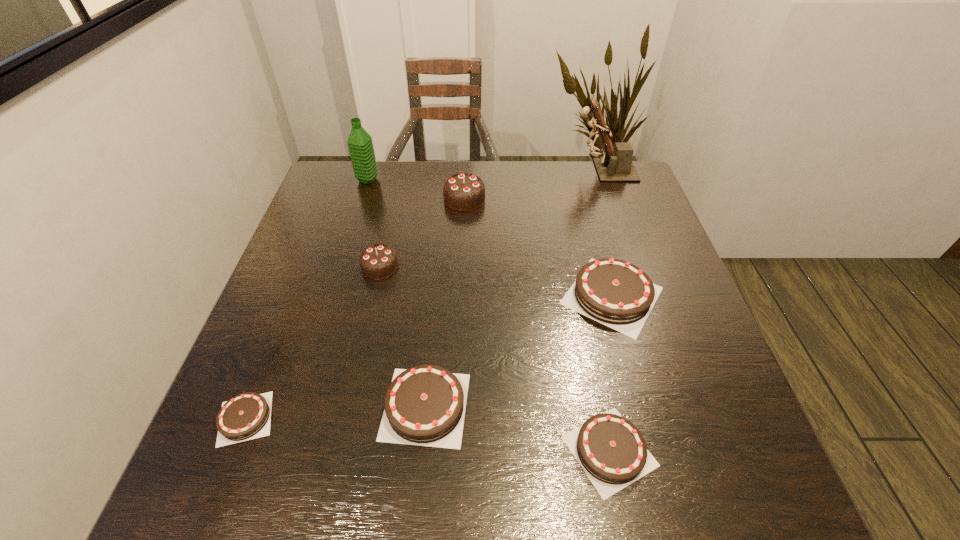
At what (x,y) coordinates should I click in order to perform the action: click on free space between the biggest brown chocolate cake and the smaller chocolate chocolate cake. Please return your answer as a coordinate pair (x, y). Looking at the image, I should click on (496, 281).

Where is `free space between the farthest brown chocolate cake and the nearer chocolate chocolate cake`? The image size is (960, 540). free space between the farthest brown chocolate cake and the nearer chocolate chocolate cake is located at coordinates (496, 281).

The width and height of the screenshot is (960, 540). I want to click on free space between the sixth nearest object and the farthest brown chocolate cake, so click(x=539, y=247).

Identify the location of free point between the bigger chocolate chocolate cake and the fifth tallest chocolate cake. (537, 325).

I want to click on vacant space that's between the left chocolate chocolate cake and the sixth tallest object, so click(402, 336).

This screenshot has height=540, width=960. Find the location of `vacant region between the water bottle and the shortest object`. vacant region between the water bottle and the shortest object is located at coordinates (306, 299).

I want to click on vacant area that lies between the third farthest object and the second shortest chocolate cake, so click(537, 325).

Image resolution: width=960 pixels, height=540 pixels. I want to click on vacant region between the bigger chocolate chocolate cake and the figurine, so click(x=534, y=185).

Where is `empty space that is in between the nearer chocolate chocolate cake and the third biggest brown chocolate cake`? Image resolution: width=960 pixels, height=540 pixels. empty space that is in between the nearer chocolate chocolate cake and the third biggest brown chocolate cake is located at coordinates (494, 359).

Point out which object is positioned as the seventh nearest to the shortest chocolate cake. Please provide its 2D coordinates. Your answer should be formatted as a tuple, i.e. [(x, y)], where the tuple contains the x and y coordinates of a point satisfying the conditions above.

[(615, 164)]